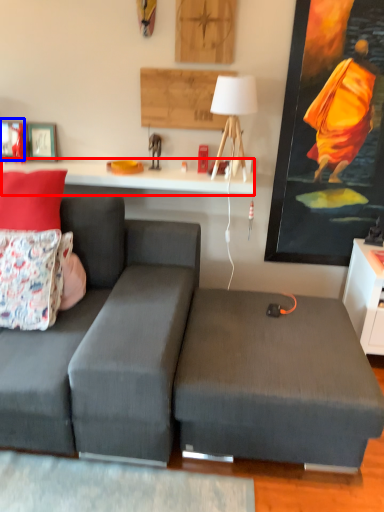
Question: Which object appears farthest to the camera in this image, table (highlighted by a red box) or picture frame (highlighted by a blue box)?

Choices:
 (A) table
 (B) picture frame

Answer: (B)